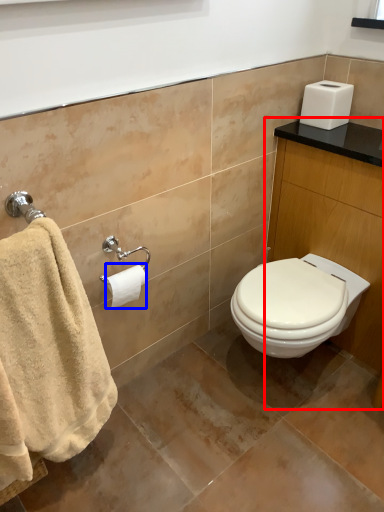
Question: Among these objects, which one is nearest to the camera, vanity (highlighted by a red box) or toilet paper (highlighted by a blue box)?

Choices:
 (A) vanity
 (B) toilet paper

Answer: (A)